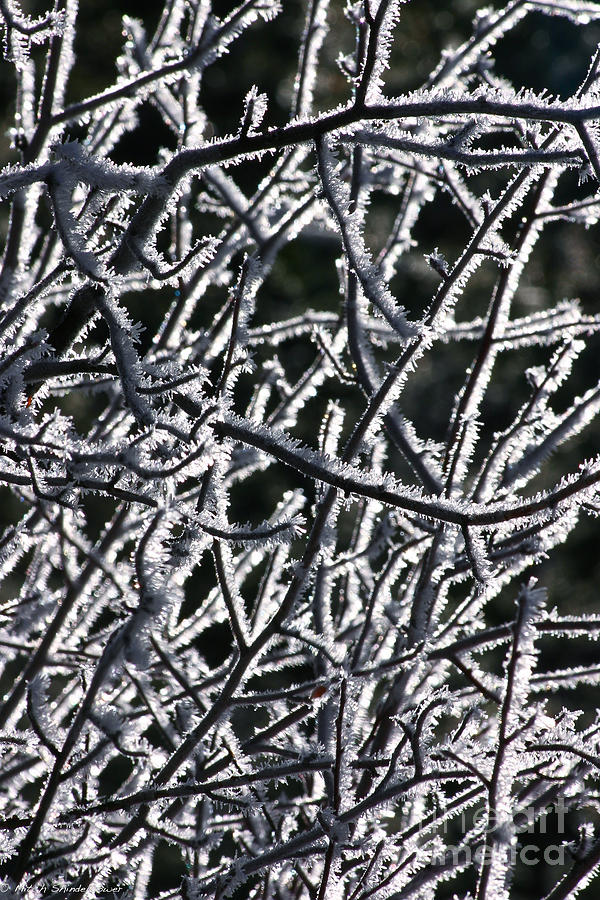
The width and height of the screenshot is (600, 900). I want to click on art, so click(x=534, y=826).